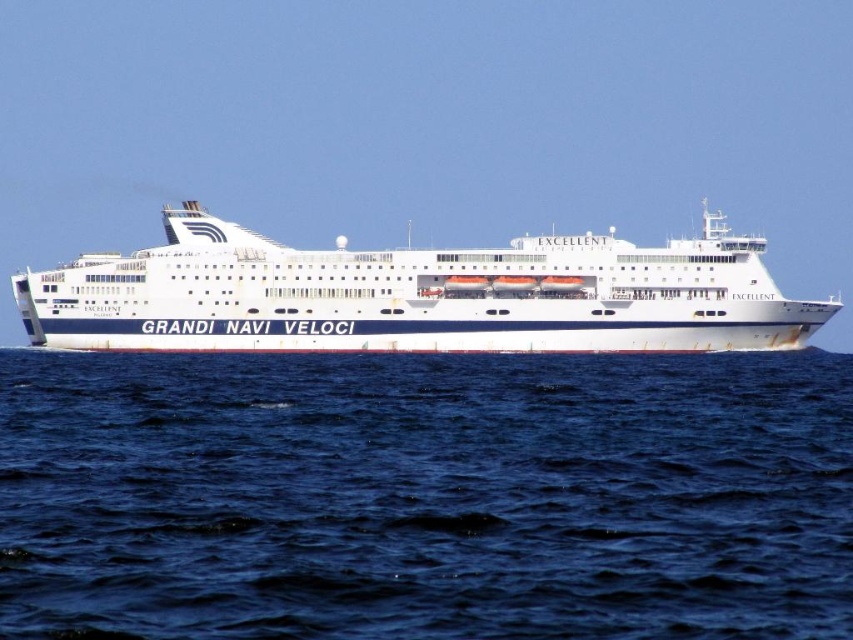
Question: Which object is closer to the camera taking this photo?

Choices:
 (A) blue water at center
 (B) white glossy cruise ship at center

Answer: (A)

Question: Does blue water at center have a larger size compared to white glossy cruise ship at center?

Choices:
 (A) yes
 (B) no

Answer: (B)

Question: Which of the following is the farthest from the observer?

Choices:
 (A) white glossy cruise ship at center
 (B) blue water at center

Answer: (A)

Question: Can you confirm if blue water at center is positioned to the left of white glossy cruise ship at center?

Choices:
 (A) yes
 (B) no

Answer: (B)

Question: Which of the following is the farthest from the observer?

Choices:
 (A) blue water at center
 (B) white glossy cruise ship at center

Answer: (B)

Question: Is blue water at center smaller than white glossy cruise ship at center?

Choices:
 (A) no
 (B) yes

Answer: (B)